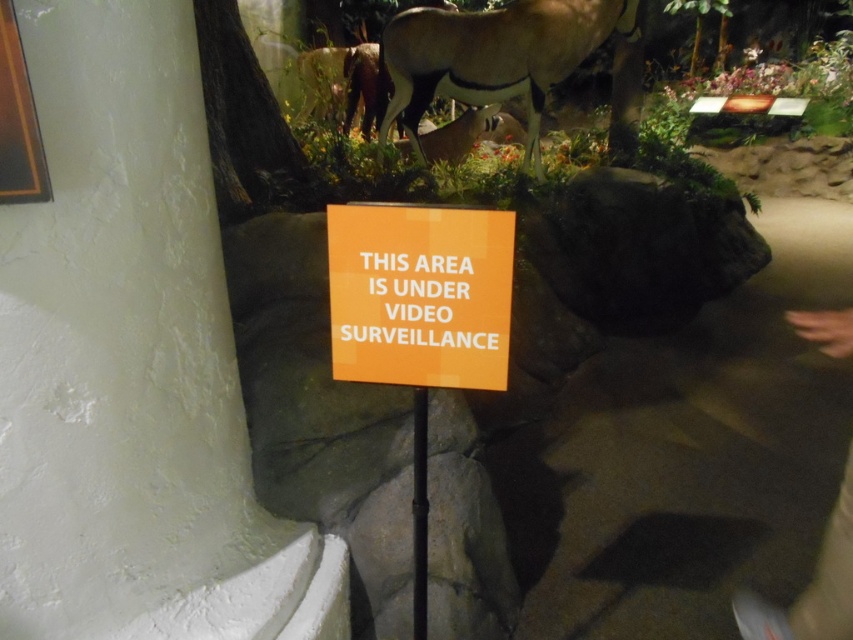
Describe the element at coordinates (811, 586) in the screenshot. I see `dark gray pants at lower right` at that location.

Does point (821, 570) come farther from viewer compared to point (495, 116)?

No, (821, 570) is closer to viewer.

Image resolution: width=853 pixels, height=640 pixels. I want to click on dark gray pants at lower right, so click(x=811, y=586).

Which of these two, orange matte sign at center or brown fur antelope at center, stands shorter?

A: With less height is orange matte sign at center.

Looking at this image, measure the distance between orange matte sign at center and camera.

orange matte sign at center and camera are 1.24 meters apart.

The height and width of the screenshot is (640, 853). Describe the element at coordinates (419, 294) in the screenshot. I see `orange matte sign at center` at that location.

Where is `orange matte sign at center`? The height and width of the screenshot is (640, 853). orange matte sign at center is located at coordinates (419, 294).

Is the position of light brown glossy antelope at center less distant than that of brown fur antelope at center?

Yes.

Is light brown glossy antelope at center wider than brown fur antelope at center?

Yes.

Find the location of a particular element. Image resolution: width=853 pixels, height=640 pixels. light brown glossy antelope at center is located at coordinates [x=492, y=58].